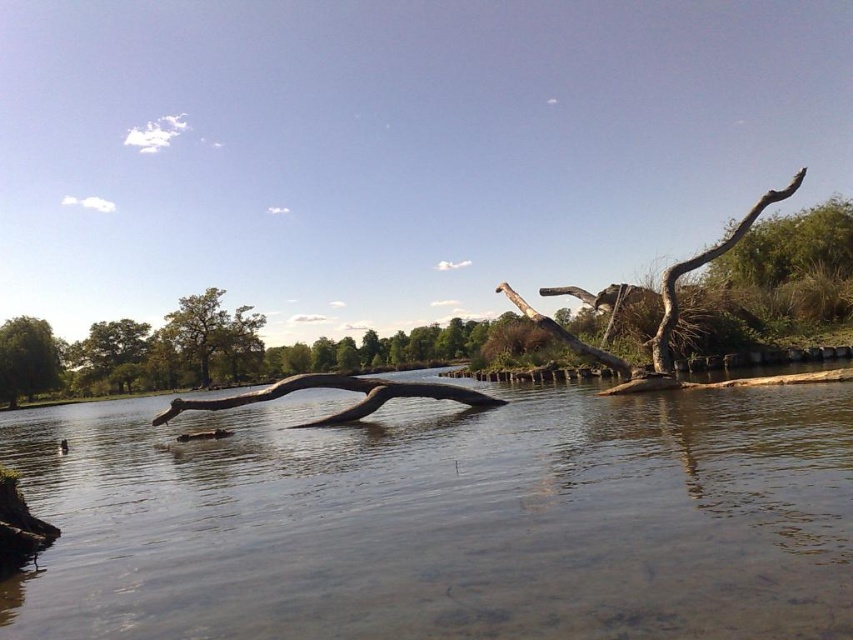
Question: Is green matte tree at upper left positioned before green matte tree at left?

Choices:
 (A) yes
 (B) no

Answer: (A)

Question: Which point is farther to the camera?

Choices:
 (A) brown wood river at center
 (B) green leafy tree at left
 (C) green matte tree at upper left

Answer: (C)

Question: Does brown wood river at center lie in front of green leafy tree at left?

Choices:
 (A) no
 (B) yes

Answer: (B)

Question: Which object appears farthest from the camera in this image?

Choices:
 (A) green matte tree at left
 (B) brown wood river at center
 (C) green leafy tree at left

Answer: (A)

Question: Can you confirm if green matte tree at upper left is bigger than green leafy tree at left?

Choices:
 (A) yes
 (B) no

Answer: (A)

Question: Which of the following is the farthest from the observer?

Choices:
 (A) (247, 356)
 (B) (28, 371)
 (C) (106, 365)

Answer: (C)